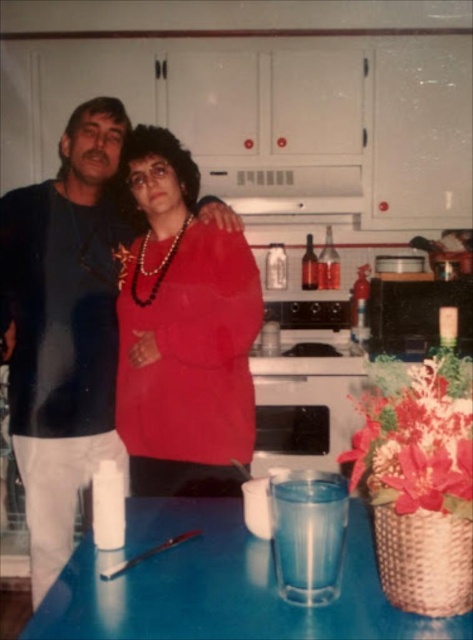
You are organizing a dinner party and need to place a 12 inch wide centerpiece on the table. Based on the image, will the matte red sweater at center and blue plastic table at lower center have enough space for it?

The matte red sweater at center is narrower than the blue plastic table at lower center. Since the sweater is smaller in width than the table, the table should have enough space to accommodate a 12 inch wide centerpiece.

You are a delivery person holding a 12 inch wide package and need to place it between the matte black shirt at left and the matte red sweater at center. Can you fit the package between them?

The distance between the matte black shirt at left and the matte red sweater at center is 10.03 inches, which is less than the 12 inch width of the package. Therefore, the package cannot fit between them.